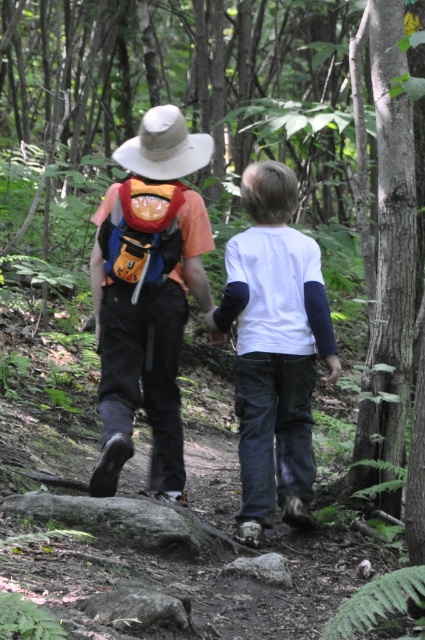
Does matte orange backpack at center appear over white cotton shirt at center?

Yes, matte orange backpack at center is above white cotton shirt at center.

Who is more distant from viewer, (102, 259) or (311, 445)?

Point (311, 445)

You are a GUI agent. You are given a task and a screenshot of the screen. Output one action in this format:
    pyautogui.click(x=<x>, y=<y>)
    Task: Click on the matte orange backpack at center
    
    Given the screenshot: What is the action you would take?
    pyautogui.click(x=147, y=296)

Which is in front, point (113, 348) or point (127, 243)?

Point (127, 243) is in front.

Is matte orange backpack at center positioned in front of orange fabric backpack at center?

Yes, it is.

At what (x,y) coordinates should I click in order to perform the action: click on matte orange backpack at center. Please return your answer as a coordinate pair (x, y). Looking at the image, I should click on (147, 296).

Which is more to the left, white cotton shirt at center or beige fabric cowboy hat at upper center?

Positioned to the left is beige fabric cowboy hat at upper center.

Is point (300, 346) positioned before point (180, 154)?

Yes, it is.

This screenshot has height=640, width=425. I want to click on white cotton shirt at center, so click(274, 349).